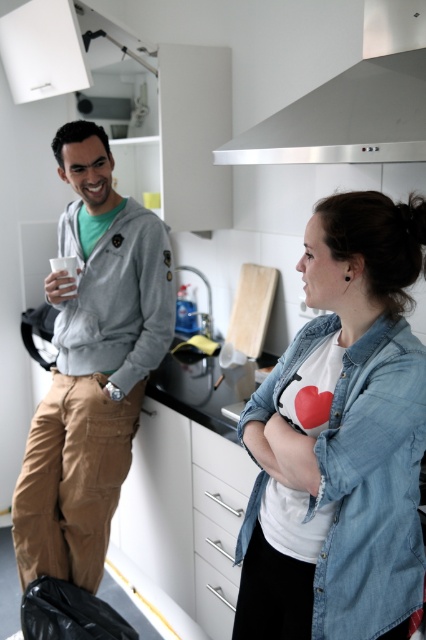
Between point (111, 362) and point (302, 148), which one is positioned behind?

The point (111, 362) is more distant.

Who is shorter, matte gray hoodie at left or stainless steel exhaust hood at upper center?

With less height is stainless steel exhaust hood at upper center.

Is point (164, 291) positioned after point (339, 147)?

Yes, point (164, 291) is farther from viewer.

Identify the location of matte gray hoodie at left. (92, 365).

At what (x,y) coordinates should I click in order to perform the action: click on denim shirt at center. Please return your answer as a coordinate pair (x, y). Image resolution: width=426 pixels, height=640 pixels. Looking at the image, I should click on (342, 440).

Find the location of `denim shirt at center`. denim shirt at center is located at coordinates (342, 440).

Which is more to the left, denim shirt at center or matte gray hoodie at left?

Positioned to the left is matte gray hoodie at left.

Between point (362, 404) and point (65, 410), which one is positioned in front?

Point (362, 404) is in front.

Is point (294, 492) behind point (104, 225)?

No, (294, 492) is in front of (104, 225).

The height and width of the screenshot is (640, 426). In order to click on denim shirt at center in this screenshot , I will do `click(342, 440)`.